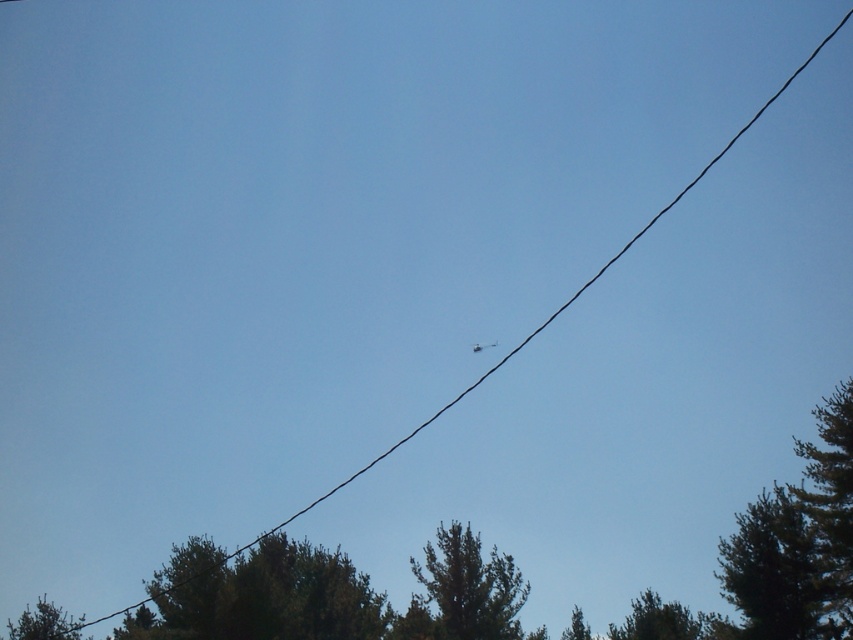
You are standing in a field and see the green leafy tree at lower left and the green leafy tree at lower right. Which tree is positioned higher in the image?

The green leafy tree at lower left is positioned higher than the green leafy tree at lower right.

You are a photographer trying to capture a photo of the green leafy tree at upper center. You have a camera with a 100mm lens. Considering the distance, will the tree fill the frame adequately?

The green leafy tree at upper center is 146.75 feet away from the camera. A 100mm lens may not be sufficient to fill the frame with the tree at this distance, as the tree might appear small in the photo. Consider using a longer telephoto lens for better framing.

You are standing at the center of the image looking towards the helicopter. Which direction should you turn to face the green leafy tree at lower right?

The green leafy tree at lower right is located at coordinates approximately 0.972 on the x and 0.785 on the y axis. Since you are facing the helicopter which is in the upper right direction, you should turn to your right to face the green leafy tree at lower right.